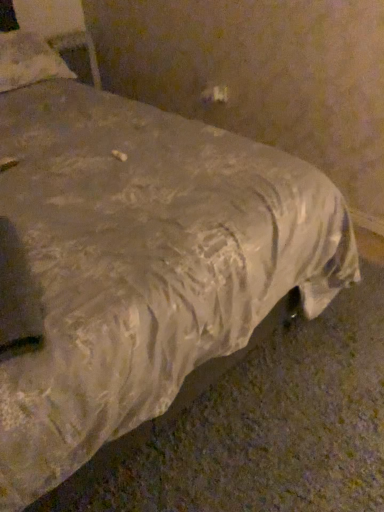
Where is `silky white pillow at upper left`? This screenshot has width=384, height=512. silky white pillow at upper left is located at coordinates (28, 60).

Describe the element at coordinates (28, 60) in the screenshot. Image resolution: width=384 pixels, height=512 pixels. I see `silky white pillow at upper left` at that location.

Locate an element on the screen. silky white pillow at upper left is located at coordinates (28, 60).